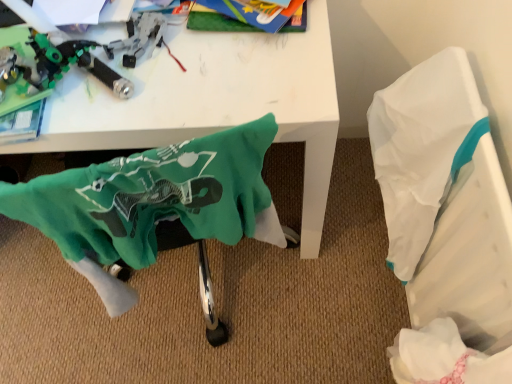
Question: Would you say green fabric swivel chair at lower left contains white glossy table at upper center?

Choices:
 (A) no
 (B) yes

Answer: (A)

Question: Does green fabric swivel chair at lower left have a greater height compared to white glossy table at upper center?

Choices:
 (A) no
 (B) yes

Answer: (A)

Question: Is green fabric swivel chair at lower left not near white glossy table at upper center?

Choices:
 (A) yes
 (B) no

Answer: (B)

Question: Considering the relative sizes of green fabric swivel chair at lower left and white glossy table at upper center in the image provided, is green fabric swivel chair at lower left wider than white glossy table at upper center?

Choices:
 (A) yes
 (B) no

Answer: (B)

Question: Considering the relative sizes of green fabric swivel chair at lower left and white glossy table at upper center in the image provided, is green fabric swivel chair at lower left bigger than white glossy table at upper center?

Choices:
 (A) yes
 (B) no

Answer: (B)

Question: From the image's perspective, is green fabric swivel chair at lower left over white glossy table at upper center?

Choices:
 (A) no
 (B) yes

Answer: (A)

Question: Does white paper at right have a lesser height compared to white glossy table at upper center?

Choices:
 (A) yes
 (B) no

Answer: (A)

Question: Is the position of white paper at right less distant than that of white glossy table at upper center?

Choices:
 (A) yes
 (B) no

Answer: (B)

Question: Is white paper at right at the right side of white glossy table at upper center?

Choices:
 (A) no
 (B) yes

Answer: (B)

Question: From a real-world perspective, is white paper at right positioned under white glossy table at upper center based on gravity?

Choices:
 (A) no
 (B) yes

Answer: (B)

Question: Is white paper at right not near white glossy table at upper center?

Choices:
 (A) yes
 (B) no

Answer: (B)

Question: From a real-world perspective, does white paper at right stand above white glossy table at upper center?

Choices:
 (A) yes
 (B) no

Answer: (B)

Question: Is white glossy table at upper center next to white paper at right and touching it?

Choices:
 (A) no
 (B) yes

Answer: (A)